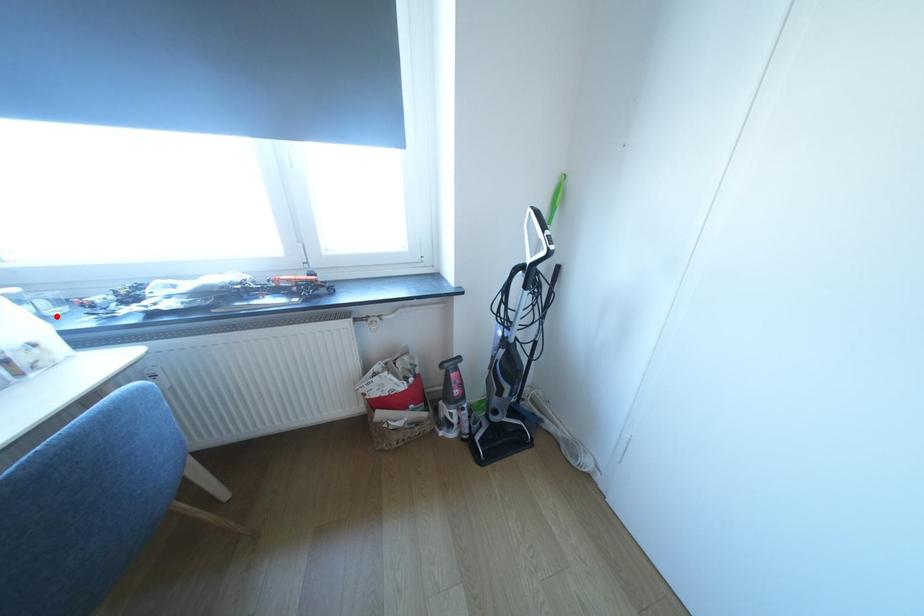
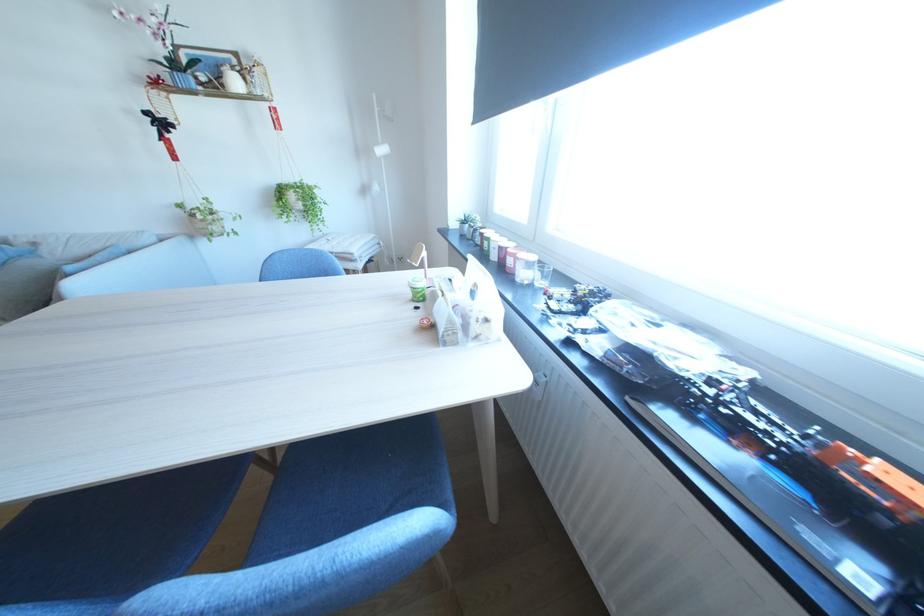
In the second image, find the point that corresponds to the highlighted location in the first image.

(545, 285)